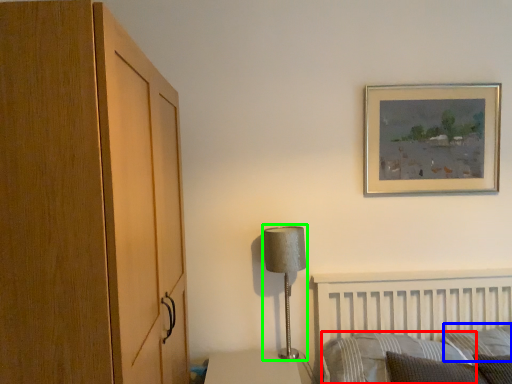
Question: Considering the real-world distances, which object is closest to pillow (highlighted by a red box)? pillow (highlighted by a blue box) or table lamp (highlighted by a green box).

Choices:
 (A) pillow
 (B) table lamp

Answer: (A)